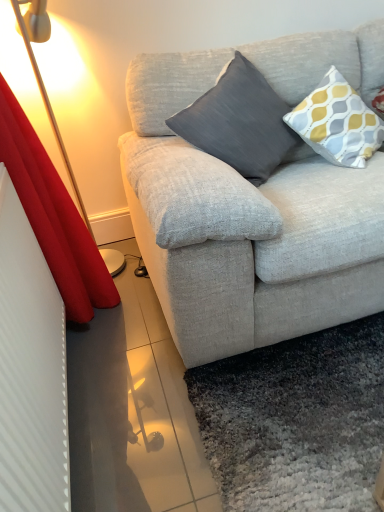
Identify the location of yellow and gray patterned pillow at upper right, marked as the first pillow in a right-to-left arrangement. Image resolution: width=384 pixels, height=512 pixels. (337, 122).

Who is bigger, dark gray fabric pillow at center, placed as the second pillow when sorted from right to left, or yellow and gray patterned pillow at upper right, the 2th pillow viewed from the left?

dark gray fabric pillow at center, placed as the second pillow when sorted from right to left.

From the image's perspective, relative to yellow and gray patterned pillow at upper right, the 2th pillow viewed from the left, is dark gray fabric pillow at center, placed as the second pillow when sorted from right to left, above or below?

From the image's perspective, dark gray fabric pillow at center, placed as the second pillow when sorted from right to left, appears below yellow and gray patterned pillow at upper right, the 2th pillow viewed from the left.

Which object is thinner, dark gray fabric pillow at center, the 1th pillow positioned from the left, or yellow and gray patterned pillow at upper right, the 2th pillow viewed from the left?

yellow and gray patterned pillow at upper right, the 2th pillow viewed from the left.

Who is bigger, red velvet curtain at left or dark gray fabric pillow at center, placed as the second pillow when sorted from right to left?

red velvet curtain at left.

How many degrees apart are the facing directions of red velvet curtain at left and dark gray fabric pillow at center, placed as the second pillow when sorted from right to left?

90.1 degrees.

Which is more to the left, red velvet curtain at left or dark gray fabric pillow at center, placed as the second pillow when sorted from right to left?

Positioned to the left is red velvet curtain at left.

How different are the orientations of dark gray fabric pillow at center, the 1th pillow positioned from the left, and red velvet curtain at left in degrees?

The facing directions of dark gray fabric pillow at center, the 1th pillow positioned from the left, and red velvet curtain at left are 90.1 degrees apart.

Which is in front, point (261, 156) or point (68, 312)?

Point (261, 156)

Looking at this image, who is bigger, dark gray fabric pillow at center, the 1th pillow positioned from the left, or red velvet curtain at left?

Bigger between the two is red velvet curtain at left.

From the image's perspective, between dark gray fabric pillow at center, placed as the second pillow when sorted from right to left, and red velvet curtain at left, who is located below?

red velvet curtain at left.

I want to click on curtain directly beneath the yellow and gray patterned pillow at upper right, the 2th pillow viewed from the left (from a real-world perspective), so click(53, 216).

From the image's perspective, which is below, red velvet curtain at left or yellow and gray patterned pillow at upper right, the 2th pillow viewed from the left?

red velvet curtain at left.

In the image, is red velvet curtain at left positioned in front of or behind yellow and gray patterned pillow at upper right, marked as the first pillow in a right-to-left arrangement?

In the image, red velvet curtain at left appears in front of yellow and gray patterned pillow at upper right, marked as the first pillow in a right-to-left arrangement.

Can you confirm if yellow and gray patterned pillow at upper right, marked as the first pillow in a right-to-left arrangement, is smaller than dark gray fabric pillow at center, placed as the second pillow when sorted from right to left?

Correct, yellow and gray patterned pillow at upper right, marked as the first pillow in a right-to-left arrangement, occupies less space than dark gray fabric pillow at center, placed as the second pillow when sorted from right to left.

Considering the sizes of objects yellow and gray patterned pillow at upper right, the 2th pillow viewed from the left, and dark gray fabric pillow at center, placed as the second pillow when sorted from right to left, in the image provided, who is wider, yellow and gray patterned pillow at upper right, the 2th pillow viewed from the left, or dark gray fabric pillow at center, placed as the second pillow when sorted from right to left,?

dark gray fabric pillow at center, placed as the second pillow when sorted from right to left, is wider.

Can you confirm if yellow and gray patterned pillow at upper right, marked as the first pillow in a right-to-left arrangement, is positioned to the left of dark gray fabric pillow at center, the 1th pillow positioned from the left?

No, yellow and gray patterned pillow at upper right, marked as the first pillow in a right-to-left arrangement, is not to the left of dark gray fabric pillow at center, the 1th pillow positioned from the left.

From the image's perspective, between yellow and gray patterned pillow at upper right, marked as the first pillow in a right-to-left arrangement, and dark gray fabric pillow at center, placed as the second pillow when sorted from right to left, who is located below?

dark gray fabric pillow at center, placed as the second pillow when sorted from right to left.

Considering the sizes of objects yellow and gray patterned pillow at upper right, marked as the first pillow in a right-to-left arrangement, and red velvet curtain at left in the image provided, who is smaller, yellow and gray patterned pillow at upper right, marked as the first pillow in a right-to-left arrangement, or red velvet curtain at left?

Smaller between the two is yellow and gray patterned pillow at upper right, marked as the first pillow in a right-to-left arrangement.

Considering the relative positions of yellow and gray patterned pillow at upper right, marked as the first pillow in a right-to-left arrangement, and red velvet curtain at left in the image provided, is yellow and gray patterned pillow at upper right, marked as the first pillow in a right-to-left arrangement, to the right of red velvet curtain at left from the viewer's perspective?

Yes, yellow and gray patterned pillow at upper right, marked as the first pillow in a right-to-left arrangement, is to the right of red velvet curtain at left.

Where is `curtain on the left of yellow and gray patterned pillow at upper right, the 2th pillow viewed from the left`? Image resolution: width=384 pixels, height=512 pixels. curtain on the left of yellow and gray patterned pillow at upper right, the 2th pillow viewed from the left is located at coordinates (53, 216).

How far apart are yellow and gray patterned pillow at upper right, the 2th pillow viewed from the left, and red velvet curtain at left?

A distance of 3.38 feet exists between yellow and gray patterned pillow at upper right, the 2th pillow viewed from the left, and red velvet curtain at left.

Where is `pillow behind the dark gray fabric pillow at center, placed as the second pillow when sorted from right to left`? pillow behind the dark gray fabric pillow at center, placed as the second pillow when sorted from right to left is located at coordinates (337, 122).

This screenshot has width=384, height=512. I want to click on curtain in front of the dark gray fabric pillow at center, placed as the second pillow when sorted from right to left, so click(53, 216).

Based on their spatial positions, is red velvet curtain at left or dark gray fabric pillow at center, the 1th pillow positioned from the left, closer to yellow and gray patterned pillow at upper right, marked as the first pillow in a right-to-left arrangement?

dark gray fabric pillow at center, the 1th pillow positioned from the left, lies closer to yellow and gray patterned pillow at upper right, marked as the first pillow in a right-to-left arrangement, than the other object.

Based on their spatial positions, is yellow and gray patterned pillow at upper right, the 2th pillow viewed from the left, or red velvet curtain at left further from dark gray fabric pillow at center, the 1th pillow positioned from the left?

red velvet curtain at left.

Estimate the real-world distances between objects in this image. Which object is further from red velvet curtain at left, dark gray fabric pillow at center, placed as the second pillow when sorted from right to left, or yellow and gray patterned pillow at upper right, marked as the first pillow in a right-to-left arrangement?

Among the two, yellow and gray patterned pillow at upper right, marked as the first pillow in a right-to-left arrangement, is located further to red velvet curtain at left.

Considering their positions, is yellow and gray patterned pillow at upper right, the 2th pillow viewed from the left, positioned closer to red velvet curtain at left than dark gray fabric pillow at center, placed as the second pillow when sorted from right to left?

Based on the image, dark gray fabric pillow at center, placed as the second pillow when sorted from right to left, appears to be nearer to red velvet curtain at left.

From the picture: Based on their spatial positions, is dark gray fabric pillow at center, placed as the second pillow when sorted from right to left, or red velvet curtain at left closer to yellow and gray patterned pillow at upper right, marked as the first pillow in a right-to-left arrangement?

The object closer to yellow and gray patterned pillow at upper right, marked as the first pillow in a right-to-left arrangement, is dark gray fabric pillow at center, placed as the second pillow when sorted from right to left.

Looking at the image, which one is located closer to dark gray fabric pillow at center, the 1th pillow positioned from the left, red velvet curtain at left or yellow and gray patterned pillow at upper right, the 2th pillow viewed from the left?

Among the two, yellow and gray patterned pillow at upper right, the 2th pillow viewed from the left, is located nearer to dark gray fabric pillow at center, the 1th pillow positioned from the left.

The height and width of the screenshot is (512, 384). I want to click on pillow between red velvet curtain at left and yellow and gray patterned pillow at upper right, marked as the first pillow in a right-to-left arrangement, from left to right, so click(x=240, y=122).